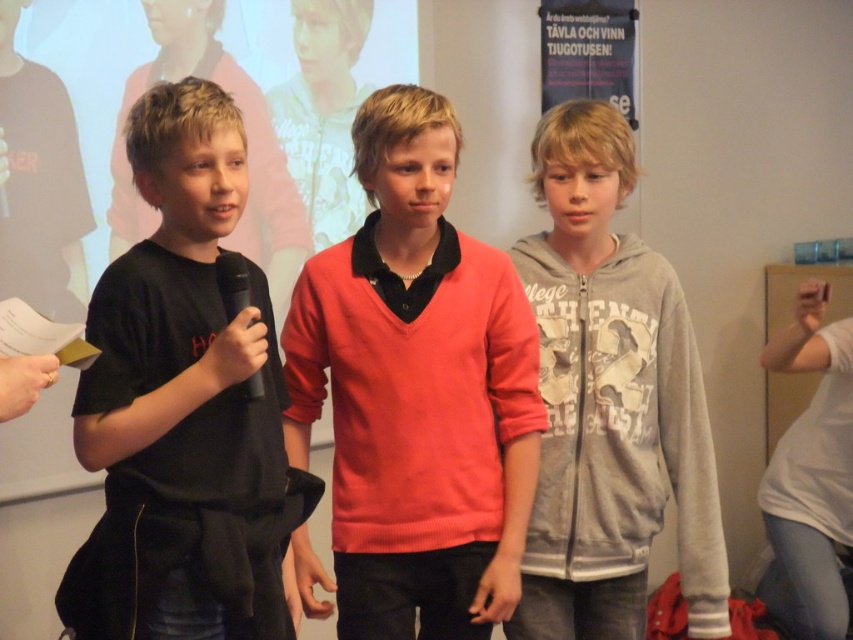
Question: Which point is closer to the camera?

Choices:
 (A) gray cotton hoodie at center
 (B) matte coral sweater at center
 (C) black matte microphone at left
 (D) black matte shirt at left

Answer: (D)

Question: Can you confirm if matte coral sweater at center is positioned to the right of black matte microphone at left?

Choices:
 (A) no
 (B) yes

Answer: (B)

Question: Is matte coral sweater at center to the left of black matte microphone at left from the viewer's perspective?

Choices:
 (A) no
 (B) yes

Answer: (A)

Question: Which of these objects is positioned farthest from the black matte microphone at left?

Choices:
 (A) black matte shirt at left
 (B) matte coral sweater at center

Answer: (B)

Question: Considering the real-world distances, which object is closest to the matte coral sweater at center?

Choices:
 (A) black matte shirt at left
 (B) black matte microphone at left

Answer: (A)

Question: Observing the image, what is the correct spatial positioning of black matte shirt at left in reference to gray cotton hoodie at center?

Choices:
 (A) above
 (B) below

Answer: (A)